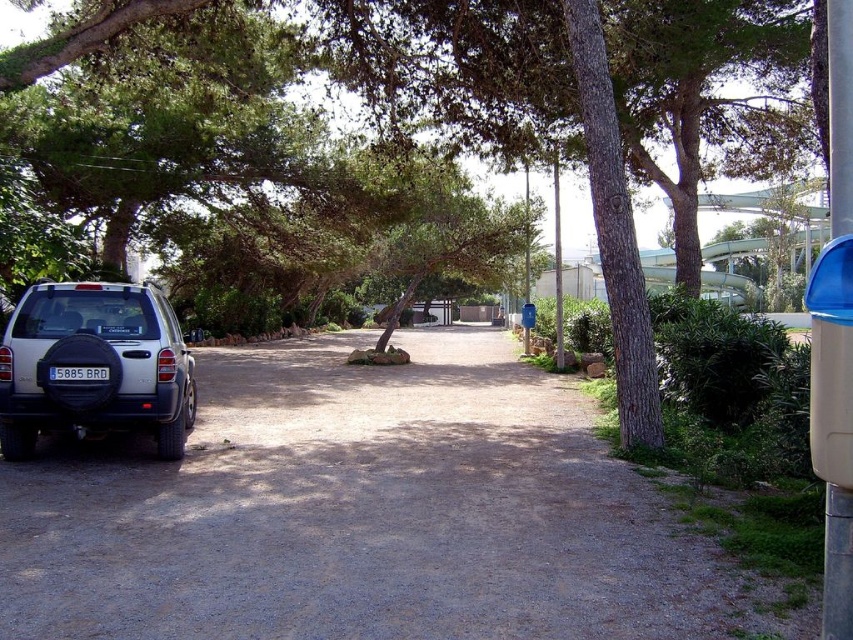
Is gray asphalt driveway at lower left behind satin silver suv at lower left?

That is False.

Measure the distance between point (x=115, y=621) and camera.

A distance of 4.25 meters exists between point (x=115, y=621) and camera.

Identify the location of gray asphalt driveway at lower left. (364, 513).

Looking at this image, does gray asphalt driveway at lower left lie behind blue matte license plate at lower left?

No, gray asphalt driveway at lower left is closer to the viewer.

Can you confirm if gray asphalt driveway at lower left is smaller than blue matte license plate at lower left?

No, gray asphalt driveway at lower left is not smaller than blue matte license plate at lower left.

Does point (427, 435) lie behind point (71, 369)?

Yes, it is behind point (71, 369).

Find the location of a particular element. gray asphalt driveway at lower left is located at coordinates (364, 513).

Describe the element at coordinates (550, 112) in the screenshot. I see `green leafy tree at center` at that location.

Is green leafy tree at center behind satin silver suv at lower left?

That is False.

Does point (436, 51) come farther from viewer compared to point (86, 348)?

Yes, point (436, 51) is farther from viewer.

Locate an element on the screen. This screenshot has height=640, width=853. green leafy tree at center is located at coordinates (550, 112).